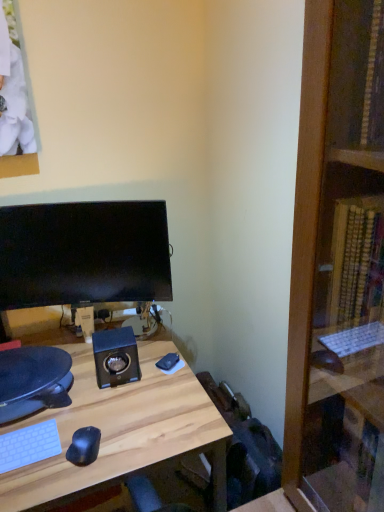
Question: From a real-world perspective, relative to light wood desk at center, is matte black monitor at center vertically above or below?

Choices:
 (A) below
 (B) above

Answer: (B)

Question: Does point (62, 284) appear closer or farther from the camera than point (59, 470)?

Choices:
 (A) farther
 (B) closer

Answer: (A)

Question: Based on their positions, is matte black monitor at center located to the left or right of light wood desk at center?

Choices:
 (A) left
 (B) right

Answer: (A)

Question: Considering the positions of point (192, 450) and point (134, 242), is point (192, 450) closer or farther from the camera than point (134, 242)?

Choices:
 (A) farther
 (B) closer

Answer: (B)

Question: Looking at their shapes, would you say light wood desk at center is wider or thinner than matte black monitor at center?

Choices:
 (A) wide
 (B) thin

Answer: (A)

Question: Would you say light wood desk at center is to the left or to the right of matte black monitor at center in the picture?

Choices:
 (A) right
 (B) left

Answer: (A)

Question: Is light wood desk at center spatially inside matte black monitor at center, or outside of it?

Choices:
 (A) inside
 (B) outside

Answer: (B)